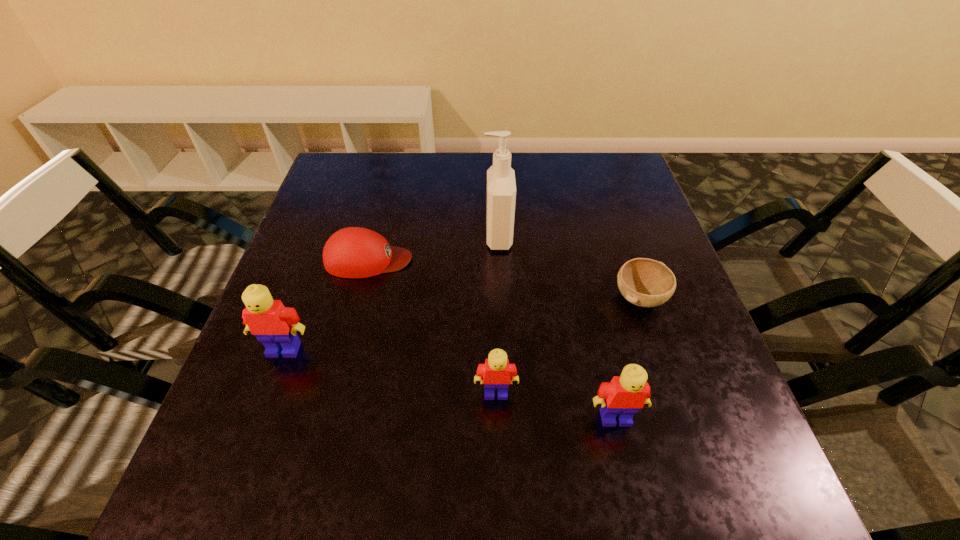
The width and height of the screenshot is (960, 540). In the image, there is a desktop. Find the location of `vacant region at the far edge`. vacant region at the far edge is located at coordinates (538, 160).

This screenshot has width=960, height=540. In order to click on vacant area at the near edge in this screenshot , I will do `click(382, 401)`.

Locate an element on the screen. vacant space at the left edge of the desktop is located at coordinates (355, 207).

You are a GUI agent. You are given a task and a screenshot of the screen. Output one action in this format:
    pyautogui.click(x=<x>, y=<y>)
    Task: Click on the vacant region at the right edge
    The height and width of the screenshot is (540, 960).
    Given the screenshot: What is the action you would take?
    pyautogui.click(x=630, y=253)

Where is `free space at the far left corner`? The width and height of the screenshot is (960, 540). free space at the far left corner is located at coordinates (359, 195).

I want to click on vacant space at the near left corner of the desktop, so 295,430.

You are a GUI agent. You are given a task and a screenshot of the screen. Output one action in this format:
    pyautogui.click(x=<x>, y=<y>)
    Task: Click on the free space that is in between the bowl and the baseball cap
    
    Given the screenshot: What is the action you would take?
    pyautogui.click(x=504, y=279)

Identify the location of free space between the nearest object and the tallest object. The width and height of the screenshot is (960, 540). (557, 327).

This screenshot has height=540, width=960. I want to click on free space between the baseball cap and the fifth object from left to right, so click(492, 339).

Image resolution: width=960 pixels, height=540 pixels. Find the location of `vacant point located between the farthest Lego and the shortest Lego`. vacant point located between the farthest Lego and the shortest Lego is located at coordinates (390, 371).